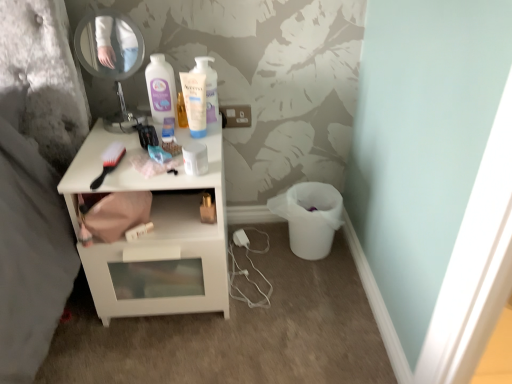
Where is `free space that is in between metallic round mirror at upper left and black plastic brush at upper left`? free space that is in between metallic round mirror at upper left and black plastic brush at upper left is located at coordinates [105, 150].